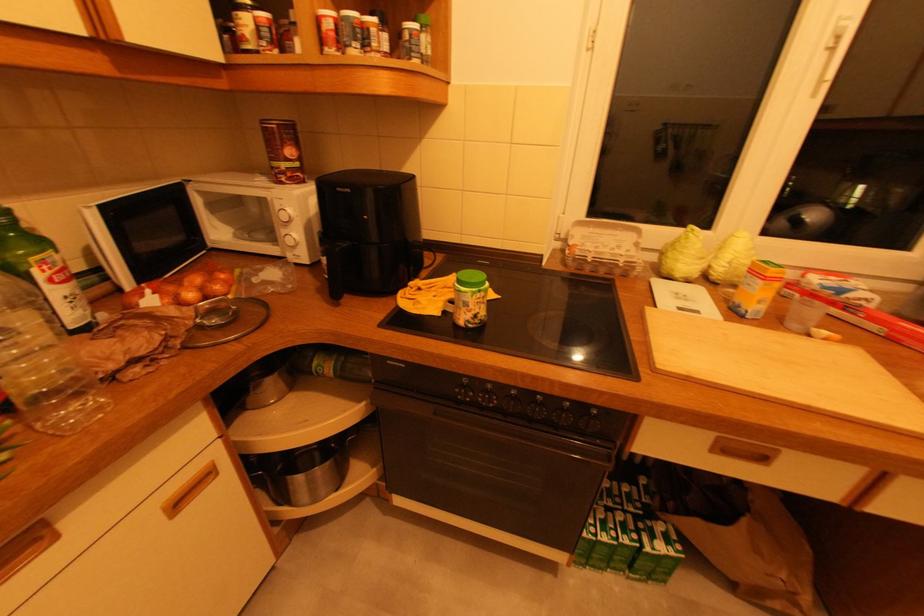
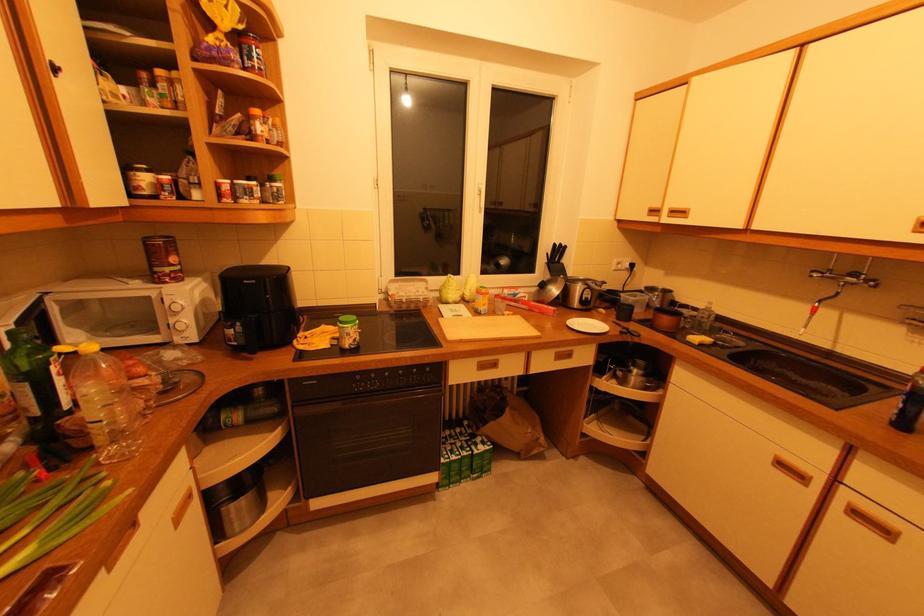
Locate, in the second image, the point that corresponds to pixel 300 217 in the first image.

(190, 307)